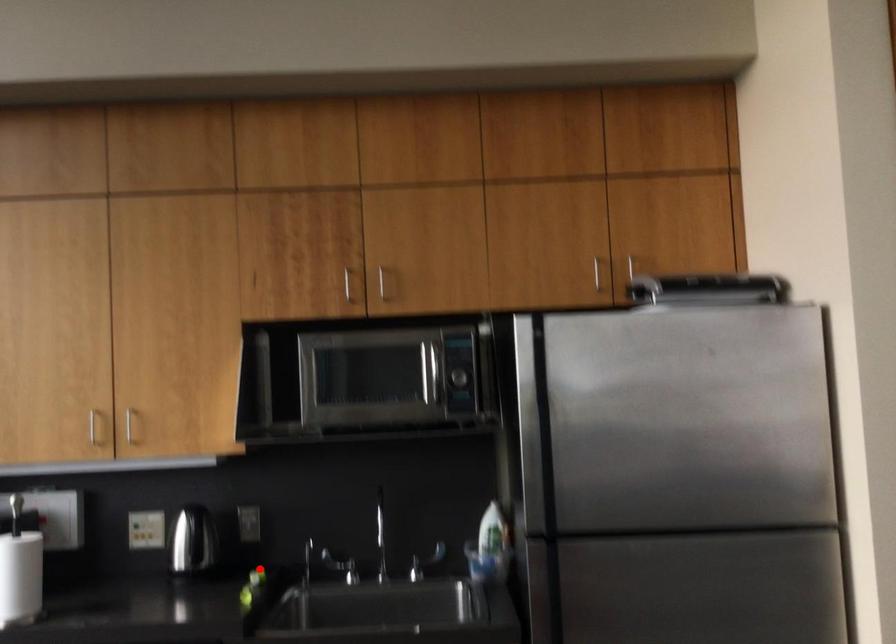
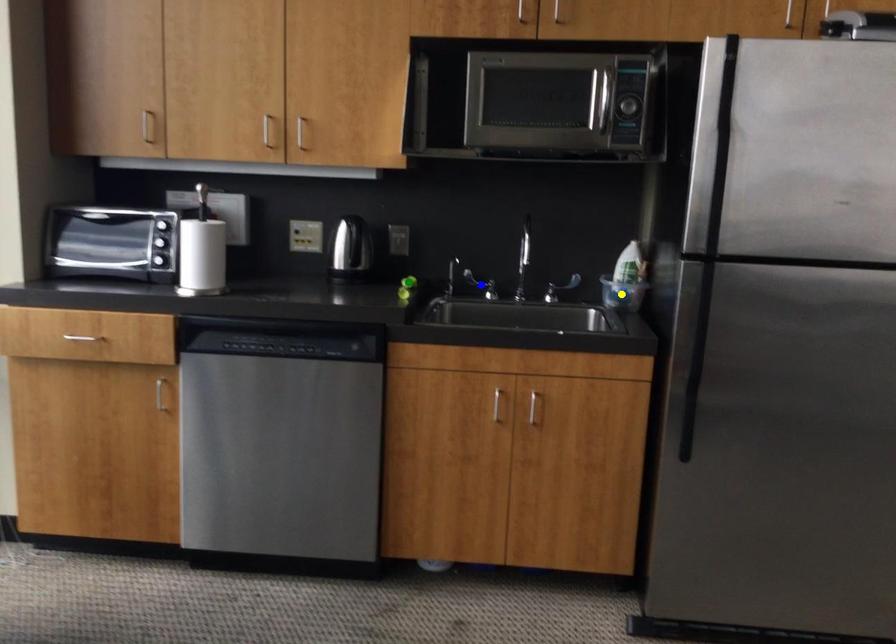
Question: I am providing you with two images of the same scene from different viewpoints. A red point is marked on the first image. You are given multiple points on the second image. Can you choose the point in image 2 that corresponds to the point in image 1?

Choices:
 (A) yellow point
 (B) blue point
 (C) green point

Answer: (C)